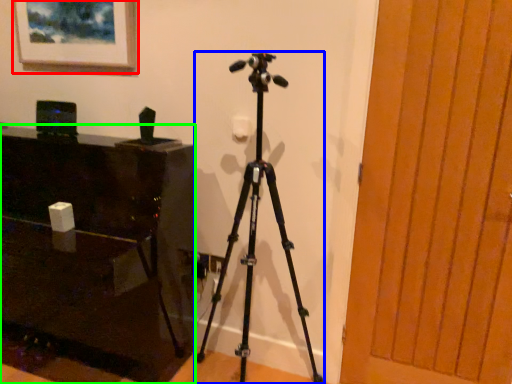
Question: Based on their relative distances, which object is nearer to picture frame (highlighted by a red box)? Choose from tripod (highlighted by a blue box) and furniture (highlighted by a green box).

Choices:
 (A) tripod
 (B) furniture

Answer: (B)